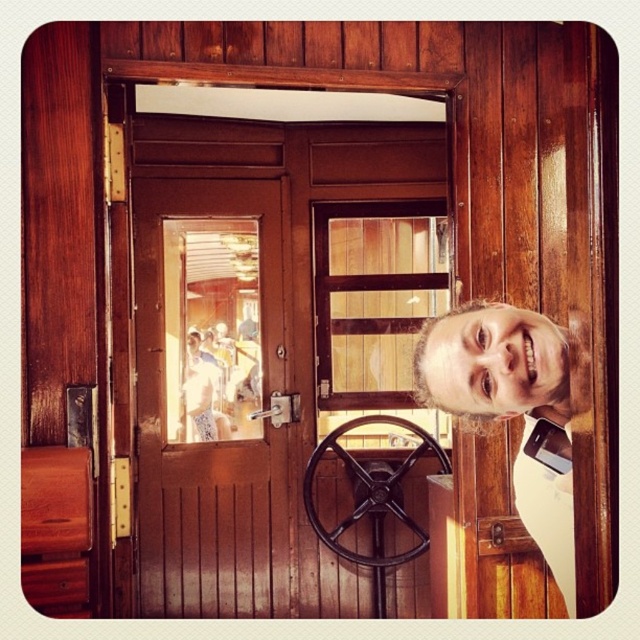
Question: From the image, what is the correct spatial relationship of smooth skin face at center in relation to matte brown nose at center?

Choices:
 (A) right
 (B) left

Answer: (A)

Question: Among these objects, which one is nearest to the camera?

Choices:
 (A) matte brown nose at center
 (B) smooth skin face at center
 (C) metallic silver door handle at center
 (D) light brown hair at right

Answer: (A)

Question: Does smooth skin face at center have a smaller size compared to metallic silver door handle at center?

Choices:
 (A) yes
 (B) no

Answer: (B)

Question: Which point is closer to the camera?

Choices:
 (A) brown wooden door at center
 (B) light brown hair at right
 (C) matte brown nose at center
 (D) metallic silver door handle at center

Answer: (C)

Question: Can you confirm if brown wooden door at center is positioned below metallic silver door handle at center?

Choices:
 (A) yes
 (B) no

Answer: (B)

Question: Which object is farther from the camera taking this photo?

Choices:
 (A) brown wooden door at center
 (B) light brown hair at right
 (C) smooth skin face at center
 (D) matte brown nose at center

Answer: (A)